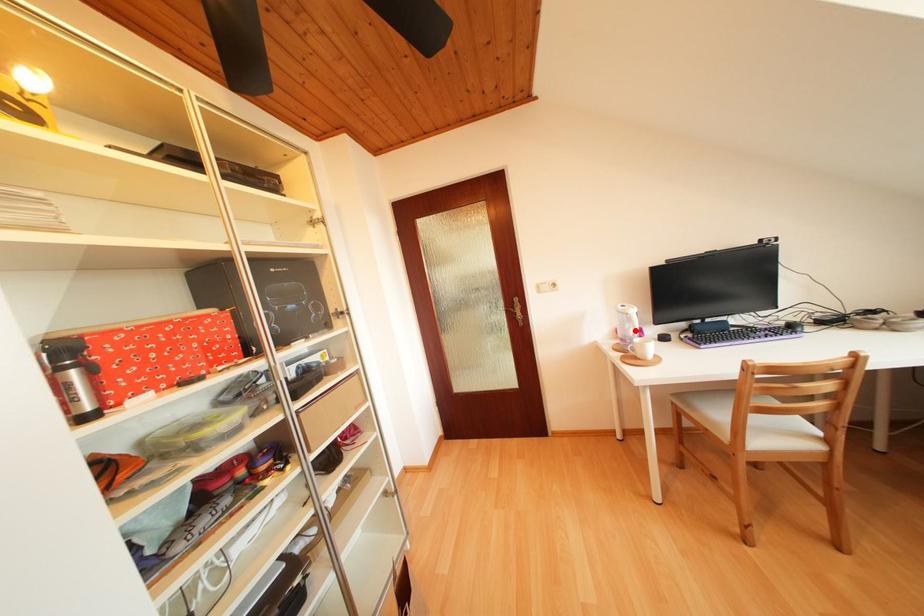
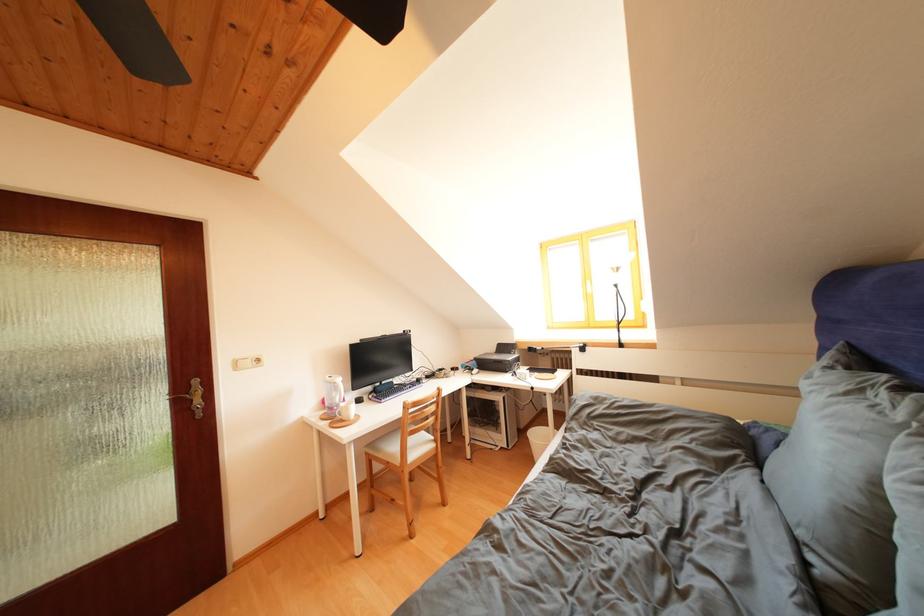
Find the pixel in the second image that matches the highlighted location in the first image.

(342, 399)